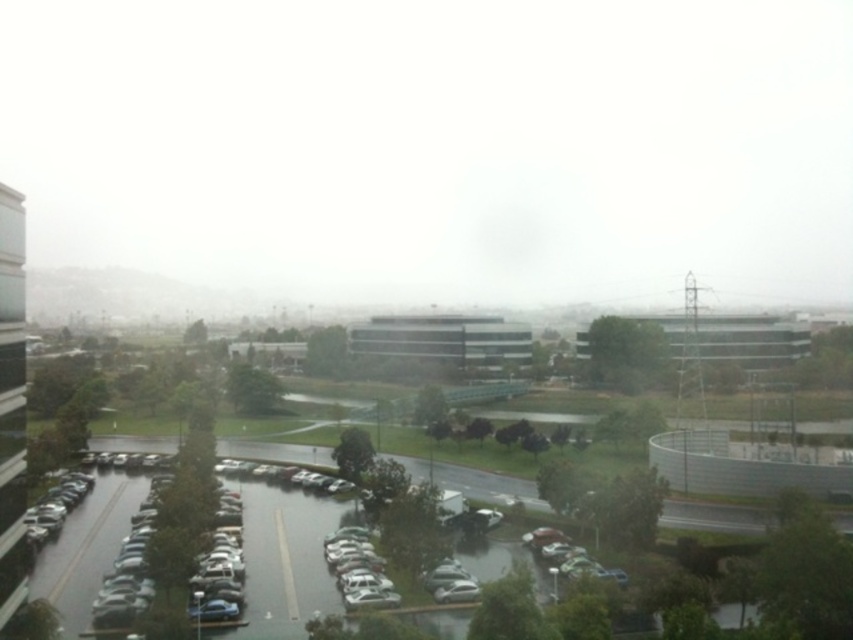
Which is behind, point (223, 216) or point (525, 483)?

The point (223, 216) is behind.

Locate an element on the screen. The height and width of the screenshot is (640, 853). white foggy sky at upper center is located at coordinates (438, 147).